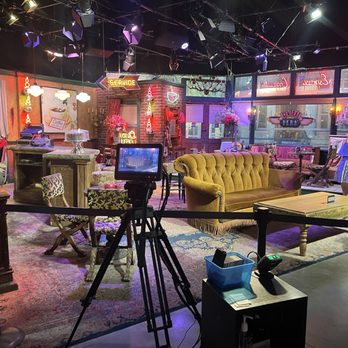
The width and height of the screenshot is (348, 348). Identify the location of cake stand. (76, 145), (79, 147).